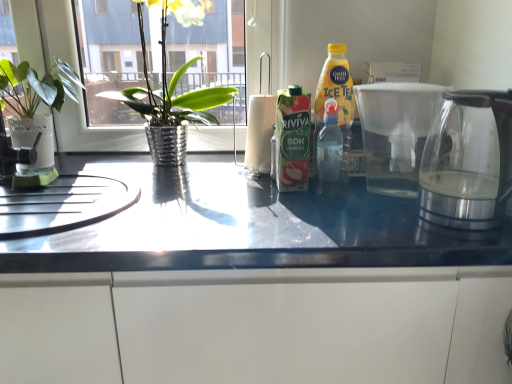
Describe the element at coordinates (396, 133) in the screenshot. This screenshot has height=384, width=512. I see `transparent glass coffeepot at right, placed as the 2th coffeepot when sorted from front to back` at that location.

From the picture: Measure the distance between point (x=338, y=293) and camera.

Point (x=338, y=293) and camera are 28.86 inches apart from each other.

In order to face glossy white cabinet at lower center, should I rotate leftwards or rightwards?

A 10.334 degree turn to the left will do.

Describe the element at coordinates (36, 87) in the screenshot. This screenshot has height=384, width=512. I see `white textured pot at left, which is the second houseplant in right-to-left order` at that location.

Describe the element at coordinates (172, 90) in the screenshot. The image size is (512, 384). I see `metallic silver pot at left, which appears as the 1th houseplant when viewed from the right` at that location.

Locate an element on the screen. green cardboard carton at center is located at coordinates (292, 139).

Locate an element on the screen. The height and width of the screenshot is (384, 512). transparent glass coffeepot at right, placed as the 2th coffeepot when sorted from front to back is located at coordinates (396, 133).

From the image's perspective, starting from the transparent glass coffeepot at right, placed as the 2th coffeepot when sorted from front to back, which houseplant is the 2nd one above? Please provide its 2D coordinates.

[(172, 90)]

Which is farther, (170, 158) or (422, 150)?

The point (170, 158) is more distant.

Could transparent glass coffeepot at right, placed as the 1th coffeepot when sorted from back to front, be considered to be inside metallic silver pot at left, which ranks as the second houseplant in left-to-right order?

No, transparent glass coffeepot at right, placed as the 1th coffeepot when sorted from back to front, is not surrounded by metallic silver pot at left, which ranks as the second houseplant in left-to-right order.

From a real-world perspective, between white textured pot at left, which is the second houseplant in right-to-left order, and glossy white cabinet at lower center, who is vertically higher?

white textured pot at left, which is the second houseplant in right-to-left order, is physically above.

From the image's perspective, who appears lower, white textured pot at left, the first houseplant in the left-to-right sequence, or glossy white cabinet at lower center?

From the image's view, glossy white cabinet at lower center is below.

Between white textured pot at left, the first houseplant in the left-to-right sequence, and glossy white cabinet at lower center, which one appears on the right side from the viewer's perspective?

From the viewer's perspective, glossy white cabinet at lower center appears more on the right side.

Is white textured pot at left, the first houseplant in the left-to-right sequence, bigger than glossy white cabinet at lower center?

No, white textured pot at left, the first houseplant in the left-to-right sequence, is not bigger than glossy white cabinet at lower center.

What's the angular difference between metallic silver pot at left, which ranks as the second houseplant in left-to-right order, and green cardboard carton at center's facing directions?

3.46 degrees.

Based on the photo, from a real-world perspective, which object rests below the other?

green cardboard carton at center is physically lower.

Who is taller, metallic silver pot at left, which appears as the 1th houseplant when viewed from the right, or green cardboard carton at center?

Standing taller between the two is metallic silver pot at left, which appears as the 1th houseplant when viewed from the right.

Is white textured pot at left, which is the second houseplant in right-to-left order, directly adjacent to transparent glass kettle at right, which is counted as the 2th coffeepot, starting from the back?

white textured pot at left, which is the second houseplant in right-to-left order, and transparent glass kettle at right, which is counted as the 2th coffeepot, starting from the back, are not in contact.

Consider the image. Between white textured pot at left, the first houseplant in the left-to-right sequence, and transparent glass kettle at right, which is counted as the 2th coffeepot, starting from the back, which one is positioned behind?

white textured pot at left, the first houseplant in the left-to-right sequence.

From the picture: Which of these two, white textured pot at left, the first houseplant in the left-to-right sequence, or transparent glass kettle at right, the first coffeepot positioned from the front, is bigger?

Bigger between the two is white textured pot at left, the first houseplant in the left-to-right sequence.

This screenshot has height=384, width=512. I want to click on coffeepot that is the 2nd one below the white textured pot at left, which is the second houseplant in right-to-left order (from a real-world perspective), so click(468, 161).

Can you confirm if metallic silver pot at left, which ranks as the second houseplant in left-to-right order, is bigger than white textured pot at left, which is the second houseplant in right-to-left order?

Correct, metallic silver pot at left, which ranks as the second houseplant in left-to-right order, is larger in size than white textured pot at left, which is the second houseplant in right-to-left order.

Does metallic silver pot at left, which appears as the 1th houseplant when viewed from the right, have a lesser width compared to white textured pot at left, the first houseplant in the left-to-right sequence?

Incorrect, the width of metallic silver pot at left, which appears as the 1th houseplant when viewed from the right, is not less than that of white textured pot at left, the first houseplant in the left-to-right sequence.

In the scene shown: Is metallic silver pot at left, which ranks as the second houseplant in left-to-right order, oriented towards white textured pot at left, the first houseplant in the left-to-right sequence?

No.

In the image, is transparent glass kettle at right, which is counted as the 2th coffeepot, starting from the back, on the left side or the right side of green cardboard carton at center?

transparent glass kettle at right, which is counted as the 2th coffeepot, starting from the back, is to the right of green cardboard carton at center.

Could green cardboard carton at center be considered to be inside transparent glass kettle at right, the first coffeepot positioned from the front?

No.

Which object is wider, transparent glass kettle at right, which is counted as the 2th coffeepot, starting from the back, or green cardboard carton at center?

With larger width is transparent glass kettle at right, which is counted as the 2th coffeepot, starting from the back.

How different are the orientations of transparent glass kettle at right, which is counted as the 2th coffeepot, starting from the back, and green cardboard carton at center in degrees?

3.9 degrees.

From the metallic silver pot at left, which ranks as the second houseplant in left-to-right order, count 2nd coffeepots forward and point to it. Please provide its 2D coordinates.

[(468, 161)]

From a real-world perspective, is transparent glass kettle at right, the first coffeepot positioned from the front, above or below metallic silver pot at left, which ranks as the second houseplant in left-to-right order?

transparent glass kettle at right, the first coffeepot positioned from the front, is below metallic silver pot at left, which ranks as the second houseplant in left-to-right order.

From the picture: Which point is more forward, (450, 103) or (161, 128)?

The point (450, 103) is closer to the camera.

In the image, is transparent glass kettle at right, which is counted as the 2th coffeepot, starting from the back, positioned in front of or behind metallic silver pot at left, which appears as the 1th houseplant when viewed from the right?

In the image, transparent glass kettle at right, which is counted as the 2th coffeepot, starting from the back, appears in front of metallic silver pot at left, which appears as the 1th houseplant when viewed from the right.

Starting from the transparent glass coffeepot at right, placed as the 2th coffeepot when sorted from front to back, which houseplant is the 1st one to the left? Please provide its 2D coordinates.

[(172, 90)]

The height and width of the screenshot is (384, 512). Find the location of `cabinetry below the white textured pot at left, which is the second houseplant in right-to-left order (from a real-world perspective)`. cabinetry below the white textured pot at left, which is the second houseplant in right-to-left order (from a real-world perspective) is located at coordinates (257, 326).

Considering their positions, is transparent glass coffeepot at right, placed as the 2th coffeepot when sorted from front to back, positioned further to green cardboard carton at center than white textured pot at left, which is the second houseplant in right-to-left order?

Based on the image, white textured pot at left, which is the second houseplant in right-to-left order, appears to be further to green cardboard carton at center.

Looking at the image, which one is located further to white textured pot at left, which is the second houseplant in right-to-left order, green cardboard carton at center or transparent glass kettle at right, which is counted as the 2th coffeepot, starting from the back?

transparent glass kettle at right, which is counted as the 2th coffeepot, starting from the back.

From the image, which object appears to be farther from white textured pot at left, the first houseplant in the left-to-right sequence, glossy white cabinet at lower center or metallic silver pot at left, which ranks as the second houseplant in left-to-right order?

Based on the image, glossy white cabinet at lower center appears to be further to white textured pot at left, the first houseplant in the left-to-right sequence.

From the image, which object appears to be nearer to transparent glass kettle at right, the first coffeepot positioned from the front, transparent glass coffeepot at right, placed as the 1th coffeepot when sorted from back to front, or white textured pot at left, which is the second houseplant in right-to-left order?

transparent glass coffeepot at right, placed as the 1th coffeepot when sorted from back to front, is closer to transparent glass kettle at right, the first coffeepot positioned from the front.

From the image, which object appears to be nearer to glossy white cabinet at lower center, transparent glass coffeepot at right, placed as the 1th coffeepot when sorted from back to front, or transparent glass kettle at right, the first coffeepot positioned from the front?

transparent glass kettle at right, the first coffeepot positioned from the front.

Which object lies further to the anchor point metallic silver pot at left, which appears as the 1th houseplant when viewed from the right, white textured pot at left, which is the second houseplant in right-to-left order, or glossy white cabinet at lower center?

Among the two, glossy white cabinet at lower center is located further to metallic silver pot at left, which appears as the 1th houseplant when viewed from the right.

From the image, which object appears to be nearer to glossy white cabinet at lower center, transparent glass coffeepot at right, placed as the 1th coffeepot when sorted from back to front, or green cardboard carton at center?

green cardboard carton at center is closer to glossy white cabinet at lower center.

Estimate the real-world distances between objects in this image. Which object is further from glossy white cabinet at lower center, transparent glass kettle at right, which is counted as the 2th coffeepot, starting from the back, or green cardboard carton at center?

green cardboard carton at center.

This screenshot has height=384, width=512. Identify the location of houseplant between white textured pot at left, the first houseplant in the left-to-right sequence, and green cardboard carton at center from left to right. (172, 90).

This screenshot has height=384, width=512. In order to click on coffeepot between glossy white cabinet at lower center and transparent glass kettle at right, the first coffeepot positioned from the front in this screenshot , I will do `click(396, 133)`.

Image resolution: width=512 pixels, height=384 pixels. I want to click on bottle between transparent glass coffeepot at right, placed as the 2th coffeepot when sorted from front to back, and glossy white cabinet at lower center, in the vertical direction, so click(x=292, y=139).

Image resolution: width=512 pixels, height=384 pixels. Find the location of `bottle between glossy white cabinet at lower center and transparent glass kettle at right, the first coffeepot positioned from the front`. bottle between glossy white cabinet at lower center and transparent glass kettle at right, the first coffeepot positioned from the front is located at coordinates (292, 139).